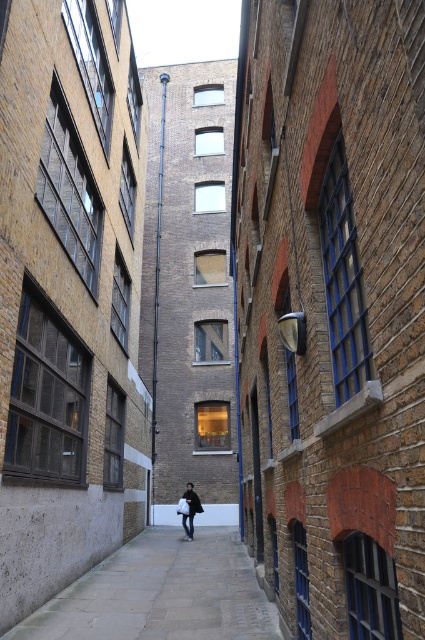
Is point (102, 596) more distant than point (184, 499)?

No, it is not.

This screenshot has height=640, width=425. Describe the element at coordinates (161, 593) in the screenshot. I see `paved stone pavement at center` at that location.

This screenshot has width=425, height=640. Find the location of `paved stone pavement at center`. paved stone pavement at center is located at coordinates (161, 593).